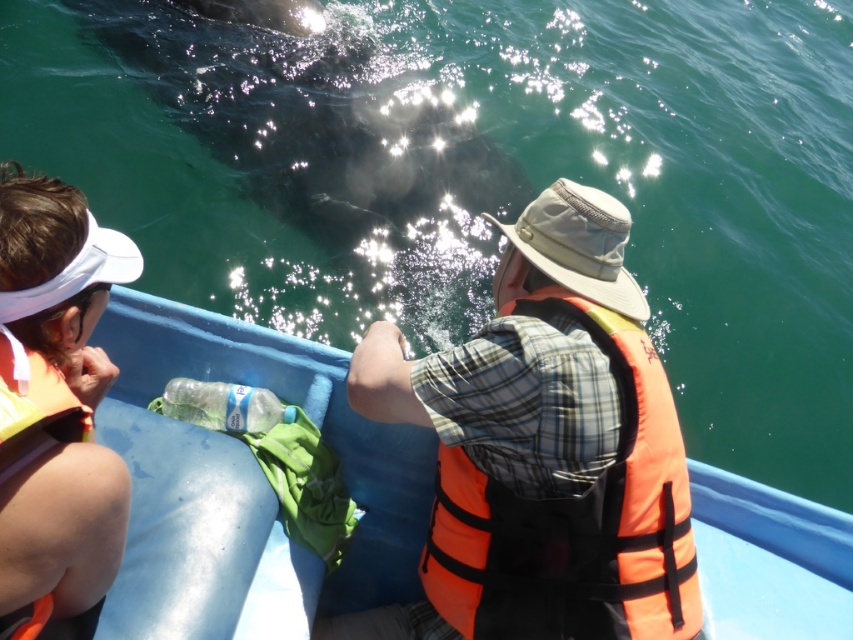
Question: Can you confirm if orange life jacket at center is positioned below orange life vest at left?

Choices:
 (A) yes
 (B) no

Answer: (A)

Question: Considering the relative positions of orange life vest at left and orange life jacket at left in the image provided, where is orange life vest at left located with respect to orange life jacket at left?

Choices:
 (A) above
 (B) below

Answer: (A)

Question: Does blue plastic boat at center appear on the left side of orange life jacket at left?

Choices:
 (A) yes
 (B) no

Answer: (B)

Question: Which point is farther to the camera?

Choices:
 (A) (596, 632)
 (B) (91, 429)
 (C) (705, 483)

Answer: (C)

Question: Which point appears farthest from the camera in this image?

Choices:
 (A) (13, 422)
 (B) (78, 364)
 (C) (448, 189)

Answer: (C)

Question: Among these points, which one is nearest to the camera?

Choices:
 (A) tap(16, 188)
 (B) tap(242, 380)

Answer: (A)